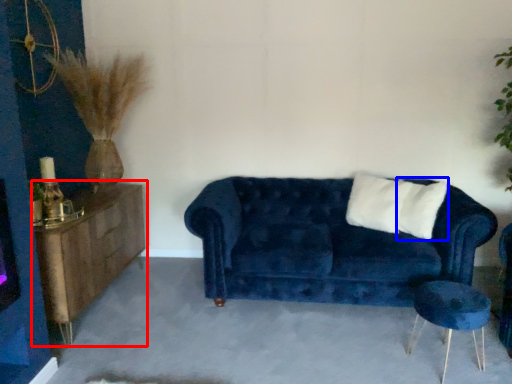
Question: Among these objects, which one is nearest to the camera, dresser (highlighted by a red box) or pillow (highlighted by a blue box)?

Choices:
 (A) dresser
 (B) pillow

Answer: (A)